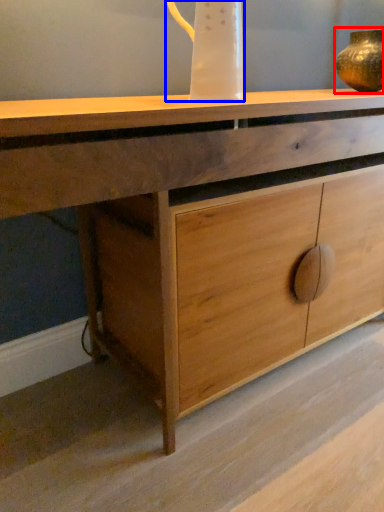
Question: Which point is further to the camera, candle holder (highlighted by a red box) or jug (highlighted by a blue box)?

Choices:
 (A) candle holder
 (B) jug

Answer: (A)